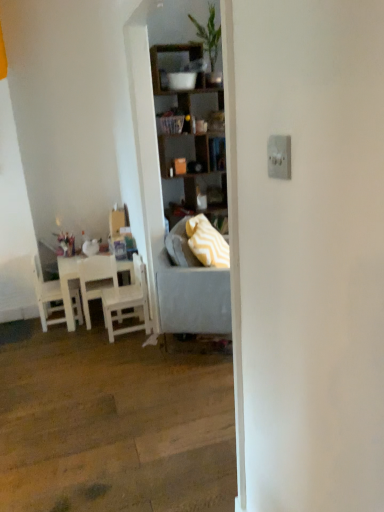
Question: Is white wood chair at left, the first chair when ordered from right to left, bigger than white matte chair at left, placed as the 2th chair when sorted from right to left?

Choices:
 (A) no
 (B) yes

Answer: (B)

Question: Is white wood chair at left, which is counted as the 3th chair, starting from the left, positioned before white matte chair at left, which ranks as the 2th chair in left-to-right order?

Choices:
 (A) no
 (B) yes

Answer: (B)

Question: Is white wood chair at left, which is counted as the 3th chair, starting from the left, next to white matte chair at left, placed as the 2th chair when sorted from right to left?

Choices:
 (A) no
 (B) yes

Answer: (A)

Question: From the image's perspective, does white wood chair at left, the first chair when ordered from right to left, appear lower than white matte chair at left, which ranks as the 2th chair in left-to-right order?

Choices:
 (A) yes
 (B) no

Answer: (A)

Question: Is white wood chair at left, the first chair when ordered from right to left, not near white matte chair at left, placed as the 2th chair when sorted from right to left?

Choices:
 (A) yes
 (B) no

Answer: (B)

Question: Looking at the image, does white wood chair at left, positioned as the third chair in right-to-left order, seem bigger or smaller compared to white wood chair at left, which is counted as the 3th chair, starting from the left?

Choices:
 (A) big
 (B) small

Answer: (B)

Question: From the image's perspective, is white wood chair at left, acting as the first chair starting from the left, above or below white wood chair at left, the first chair when ordered from right to left?

Choices:
 (A) below
 (B) above

Answer: (B)

Question: Considering the positions of white wood chair at left, acting as the first chair starting from the left, and white wood chair at left, the first chair when ordered from right to left, in the image, is white wood chair at left, acting as the first chair starting from the left, wider or thinner than white wood chair at left, the first chair when ordered from right to left,?

Choices:
 (A) thin
 (B) wide

Answer: (A)

Question: Would you say white wood chair at left, positioned as the third chair in right-to-left order, is to the left or to the right of white wood chair at left, which is counted as the 3th chair, starting from the left, in the picture?

Choices:
 (A) left
 (B) right

Answer: (A)

Question: Choose the correct answer: Is wooden shelves at center inside white matte chair at left, which ranks as the 2th chair in left-to-right order, or outside it?

Choices:
 (A) outside
 (B) inside

Answer: (A)

Question: Is wooden shelves at center taller or shorter than white matte chair at left, placed as the 2th chair when sorted from right to left?

Choices:
 (A) short
 (B) tall

Answer: (B)

Question: Considering the positions of wooden shelves at center and white matte chair at left, which ranks as the 2th chair in left-to-right order, in the image, is wooden shelves at center bigger or smaller than white matte chair at left, which ranks as the 2th chair in left-to-right order,?

Choices:
 (A) big
 (B) small

Answer: (A)

Question: From a real-world perspective, is wooden shelves at center physically located above or below white matte chair at left, placed as the 2th chair when sorted from right to left?

Choices:
 (A) above
 (B) below

Answer: (A)

Question: From the image's perspective, is white matte table at left located above or below yellow zigzag fabric pillow at center?

Choices:
 (A) below
 (B) above

Answer: (A)

Question: From a real-world perspective, is white matte table at left physically located above or below yellow zigzag fabric pillow at center?

Choices:
 (A) above
 (B) below

Answer: (B)